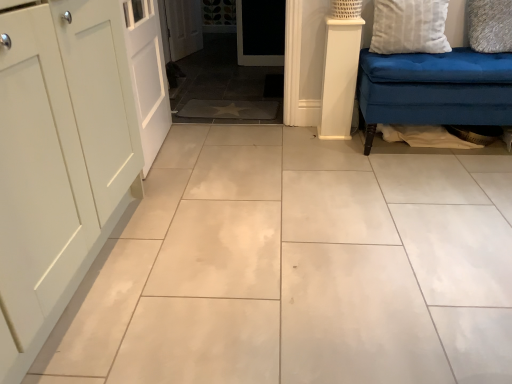
Question: Does white textured pillow at upper right, the 1th pillow positioned from the left, come behind white smooth column at right?

Choices:
 (A) yes
 (B) no

Answer: (B)

Question: From the image's perspective, is white textured pillow at upper right, the 1th pillow positioned from the left, located above white smooth column at right?

Choices:
 (A) no
 (B) yes

Answer: (B)

Question: Is white textured pillow at upper right, arranged as the 2th pillow when viewed from the right, surrounding white smooth column at right?

Choices:
 (A) yes
 (B) no

Answer: (B)

Question: Would you consider white textured pillow at upper right, arranged as the 2th pillow when viewed from the right, to be distant from white smooth column at right?

Choices:
 (A) yes
 (B) no

Answer: (B)

Question: Is white textured pillow at upper right, the 1th pillow positioned from the left, looking in the opposite direction of white smooth column at right?

Choices:
 (A) no
 (B) yes

Answer: (A)

Question: In the image, is white painted wood door at left on the left side or the right side of white textured pillow at upper right, the 1th pillow positioned from the left?

Choices:
 (A) left
 (B) right

Answer: (A)

Question: In the image, is white painted wood door at left positioned in front of or behind white textured pillow at upper right, arranged as the 2th pillow when viewed from the right?

Choices:
 (A) front
 (B) behind

Answer: (A)

Question: Considering the positions of white painted wood door at left and white textured pillow at upper right, the 1th pillow positioned from the left, in the image, is white painted wood door at left taller or shorter than white textured pillow at upper right, the 1th pillow positioned from the left,?

Choices:
 (A) short
 (B) tall

Answer: (B)

Question: In terms of size, does white painted wood door at left appear bigger or smaller than white textured pillow at upper right, the 1th pillow positioned from the left?

Choices:
 (A) small
 (B) big

Answer: (B)

Question: In the image, is white painted wood door at left on the left side or the right side of white smooth column at right?

Choices:
 (A) right
 (B) left

Answer: (B)

Question: Would you say white painted wood door at left is inside or outside white smooth column at right?

Choices:
 (A) outside
 (B) inside

Answer: (A)

Question: From a real-world perspective, is white painted wood door at left physically located above or below white smooth column at right?

Choices:
 (A) below
 (B) above

Answer: (B)

Question: Looking at their shapes, would you say white painted wood door at left is wider or thinner than white smooth column at right?

Choices:
 (A) wide
 (B) thin

Answer: (B)

Question: Based on their sizes in the image, would you say white smooth column at right is bigger or smaller than white painted wood door at left?

Choices:
 (A) big
 (B) small

Answer: (B)

Question: In terms of height, does white smooth column at right look taller or shorter compared to white painted wood door at left?

Choices:
 (A) short
 (B) tall

Answer: (A)